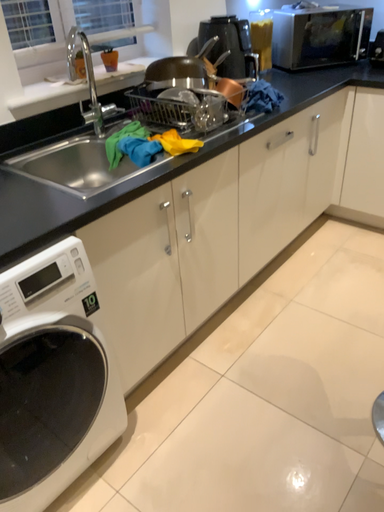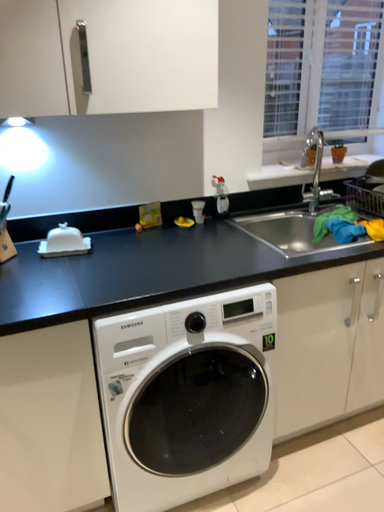
Question: How did the camera likely rotate when shooting the video?

Choices:
 (A) rotated right
 (B) rotated left

Answer: (B)